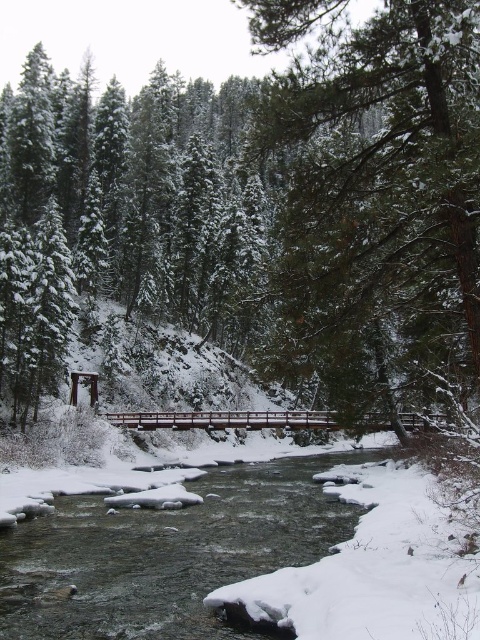
Question: Is green textured tree at center further to camera compared to white snowy stream at center?

Choices:
 (A) yes
 (B) no

Answer: (B)

Question: Does green textured tree at center have a lesser width compared to white snowy stream at center?

Choices:
 (A) no
 (B) yes

Answer: (A)

Question: Which point is closer to the camera?

Choices:
 (A) (431, 77)
 (B) (194, 563)

Answer: (A)

Question: Among these objects, which one is farthest from the camera?

Choices:
 (A) white snowy stream at center
 (B) green textured tree at center

Answer: (A)

Question: Observing the image, what is the correct spatial positioning of green textured tree at center in reference to white snowy stream at center?

Choices:
 (A) right
 (B) left

Answer: (A)

Question: Which point is closer to the camera?

Choices:
 (A) green textured tree at center
 (B) white snowy stream at center

Answer: (A)